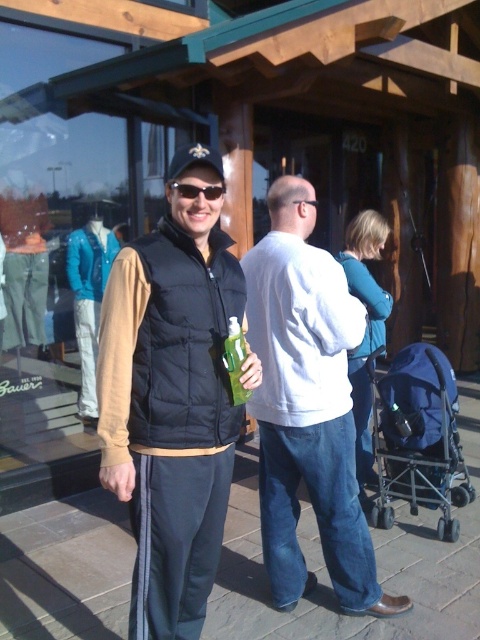
Question: Is white cotton shirt at center wider than blue fabric stroller at lower right?

Choices:
 (A) no
 (B) yes

Answer: (B)

Question: Is white cotton shirt at center further to the viewer compared to teal sweater at center?

Choices:
 (A) yes
 (B) no

Answer: (B)

Question: Which object is closer to the camera taking this photo?

Choices:
 (A) black puffer vest at center
 (B) white cotton shirt at center
 (C) teal sweater at center
 (D) blue fabric stroller at lower right

Answer: (A)

Question: Among these points, which one is nearest to the camera?

Choices:
 (A) (368, 556)
 (B) (384, 458)

Answer: (A)

Question: Is white cotton shirt at center closer to camera compared to blue fabric stroller at lower right?

Choices:
 (A) no
 (B) yes

Answer: (B)

Question: Which point is closer to the camera taking this photo?

Choices:
 (A) (407, 348)
 (B) (367, 472)

Answer: (A)